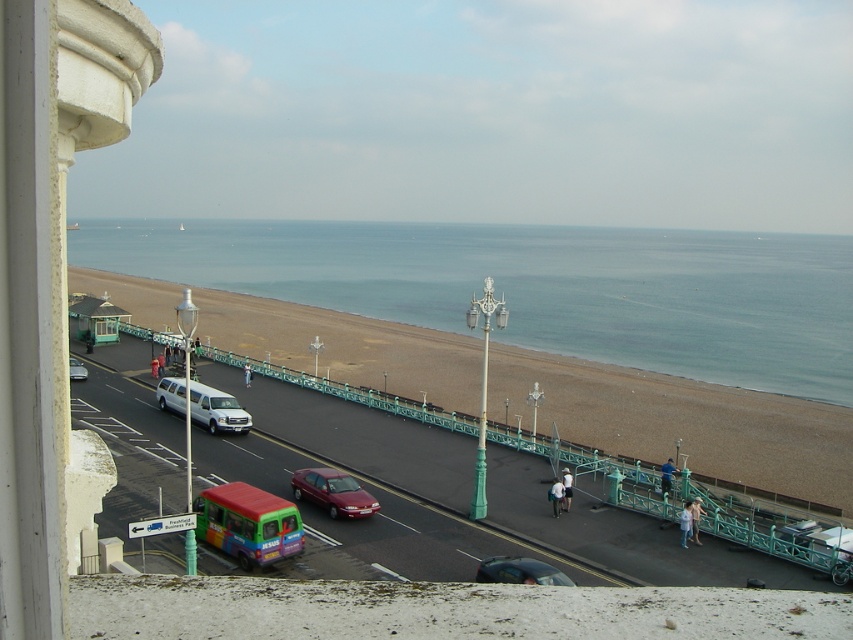
Question: Which point appears closest to the camera in this image?

Choices:
 (A) (329, 513)
 (B) (213, 410)
 (C) (508, 561)
 (D) (229, 348)

Answer: (C)

Question: Is brown sand at lower center to the right of metallic silver van at center-left from the viewer's perspective?

Choices:
 (A) no
 (B) yes

Answer: (A)

Question: Can you confirm if white glossy van at center is wider than shiny red sedan at center?

Choices:
 (A) yes
 (B) no

Answer: (A)

Question: Which object is closer to the camera taking this photo?

Choices:
 (A) shiny red sedan at center
 (B) white glossy van at center
 (C) brown sand at lower center

Answer: (B)

Question: Among these objects, which one is nearest to the camera?

Choices:
 (A) white glossy van at center
 (B) shiny red sedan at center
 (C) metallic silver van at center-left

Answer: (A)

Question: Is white glossy van at center smaller than shiny red sedan at center?

Choices:
 (A) no
 (B) yes

Answer: (A)